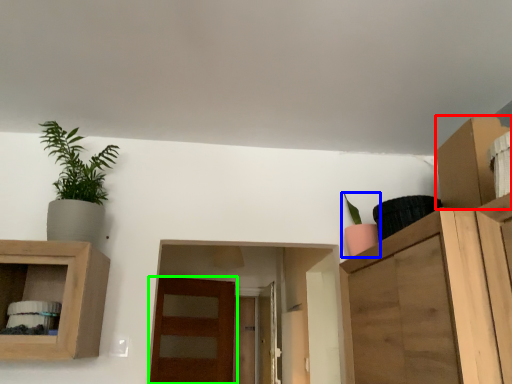
Question: Which object is the farthest from cabinet (highlighted by a red box)? Choose among these: houseplant (highlighted by a blue box) or door (highlighted by a green box).

Choices:
 (A) houseplant
 (B) door

Answer: (B)